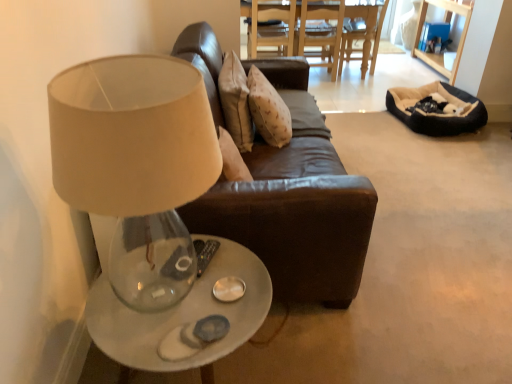
Question: From a real-world perspective, is wooden dining table at center, placed as the 2th table when sorted from bottom to top, located beneath translucent glass table at lower left, which is counted as the second table, starting from the right?

Choices:
 (A) yes
 (B) no

Answer: (B)

Question: Is the depth of wooden dining table at center, placed as the second table when sorted from left to right, greater than that of translucent glass table at lower left, which ranks as the 1th table in left-to-right order?

Choices:
 (A) yes
 (B) no

Answer: (A)

Question: Could you tell me if wooden dining table at center, the first table from the top, is facing translucent glass table at lower left, the 1th table from the bottom?

Choices:
 (A) no
 (B) yes

Answer: (B)

Question: Considering the relative sizes of wooden dining table at center, placed as the second table when sorted from left to right, and translucent glass table at lower left, acting as the 2th table starting from the back, in the image provided, is wooden dining table at center, placed as the second table when sorted from left to right, bigger than translucent glass table at lower left, acting as the 2th table starting from the back,?

Choices:
 (A) no
 (B) yes

Answer: (B)

Question: Can you confirm if wooden dining table at center, which is the 2th table in front-to-back order, is thinner than translucent glass table at lower left, the 1th table from the bottom?

Choices:
 (A) yes
 (B) no

Answer: (B)

Question: Does wooden dining table at center, the first table from the top, have a lesser height compared to translucent glass table at lower left, which is the second table in top-to-bottom order?

Choices:
 (A) yes
 (B) no

Answer: (B)

Question: Considering the relative positions of beige fabric lampshade at upper left and beige plush bean bag at right in the image provided, is beige fabric lampshade at upper left to the right of beige plush bean bag at right from the viewer's perspective?

Choices:
 (A) yes
 (B) no

Answer: (B)

Question: Is beige fabric lampshade at upper left positioned with its back to beige plush bean bag at right?

Choices:
 (A) yes
 (B) no

Answer: (B)

Question: From a real-world perspective, is beige fabric lampshade at upper left over beige plush bean bag at right?

Choices:
 (A) no
 (B) yes

Answer: (B)

Question: Is beige fabric lampshade at upper left completely or partially outside of beige plush bean bag at right?

Choices:
 (A) no
 (B) yes

Answer: (B)

Question: From the image's perspective, is beige fabric lampshade at upper left below beige plush bean bag at right?

Choices:
 (A) yes
 (B) no

Answer: (A)

Question: Does beige fabric lampshade at upper left have a smaller size compared to beige plush bean bag at right?

Choices:
 (A) yes
 (B) no

Answer: (B)

Question: From a real-world perspective, is beige plush bean bag at right on brown leather chair at upper center?

Choices:
 (A) yes
 (B) no

Answer: (B)